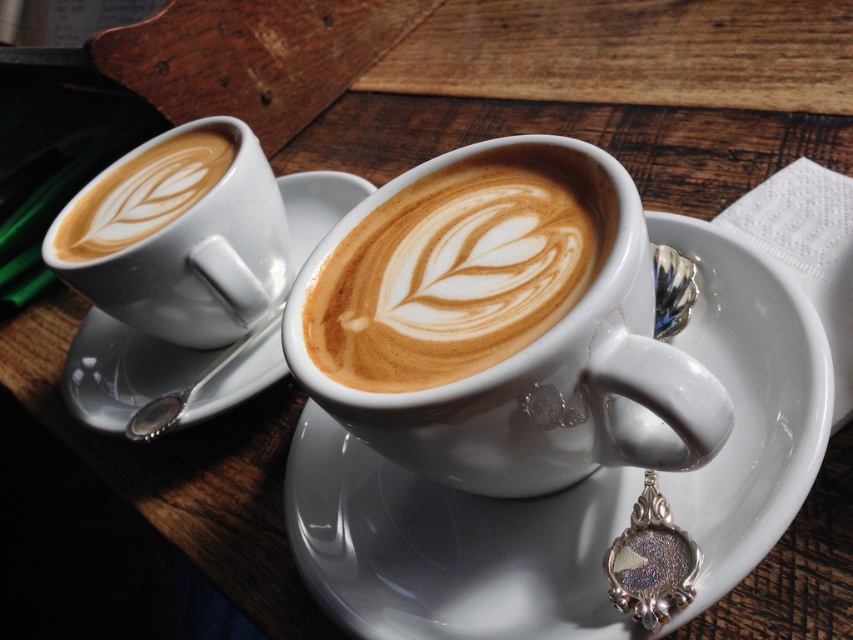
Where is `white ceramic saucer at upper left`? This screenshot has height=640, width=853. white ceramic saucer at upper left is located at coordinates (161, 376).

Between point (265, 332) and point (149, 157), which one is positioned in front?

Point (265, 332)

Is point (149, 420) positioned behind point (144, 205)?

No, (149, 420) is closer to viewer.

You are a GUI agent. You are given a task and a screenshot of the screen. Output one action in this format:
    pyautogui.click(x=<x>, y=<y>)
    Task: Click on the white ceramic saucer at upper left
    
    Given the screenshot: What is the action you would take?
    pyautogui.click(x=161, y=376)

Is point (468, 541) closer to viewer compared to point (165, 356)?

That is True.

What do you see at coordinates (448, 547) in the screenshot?
I see `white glossy saucer at center` at bounding box center [448, 547].

The height and width of the screenshot is (640, 853). What do you see at coordinates (448, 547) in the screenshot?
I see `white glossy saucer at center` at bounding box center [448, 547].

Locate an element on the screen. The width and height of the screenshot is (853, 640). white glossy saucer at center is located at coordinates (448, 547).

Does white glossy saucer at center appear over white matte cup at center?

No, white glossy saucer at center is not above white matte cup at center.

Can you confirm if white glossy saucer at center is positioned to the left of white matte cup at center?

Incorrect, white glossy saucer at center is not on the left side of white matte cup at center.

Is point (556, 540) positioned in front of point (427, 211)?

No, it is behind (427, 211).

The image size is (853, 640). In order to click on white glossy saucer at center in this screenshot , I will do `click(448, 547)`.